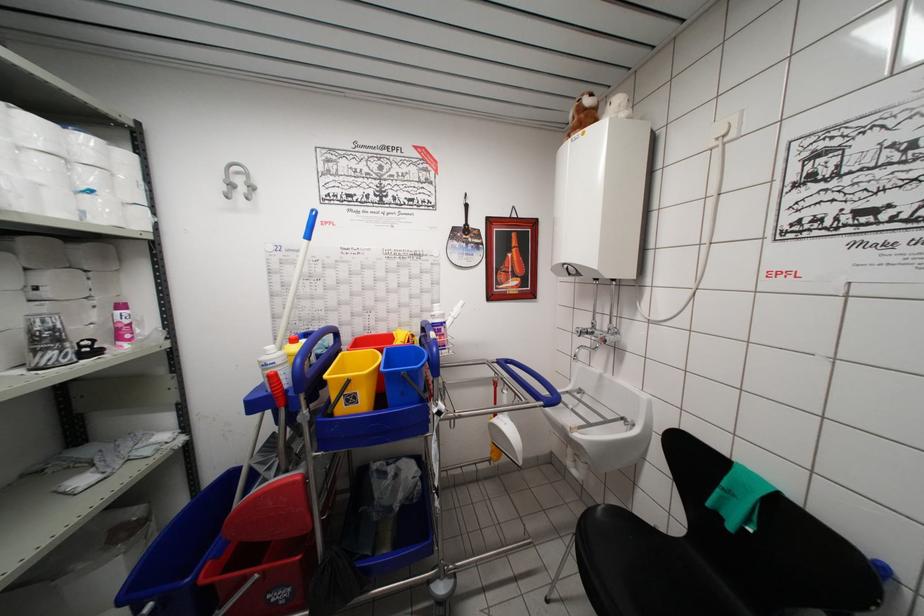
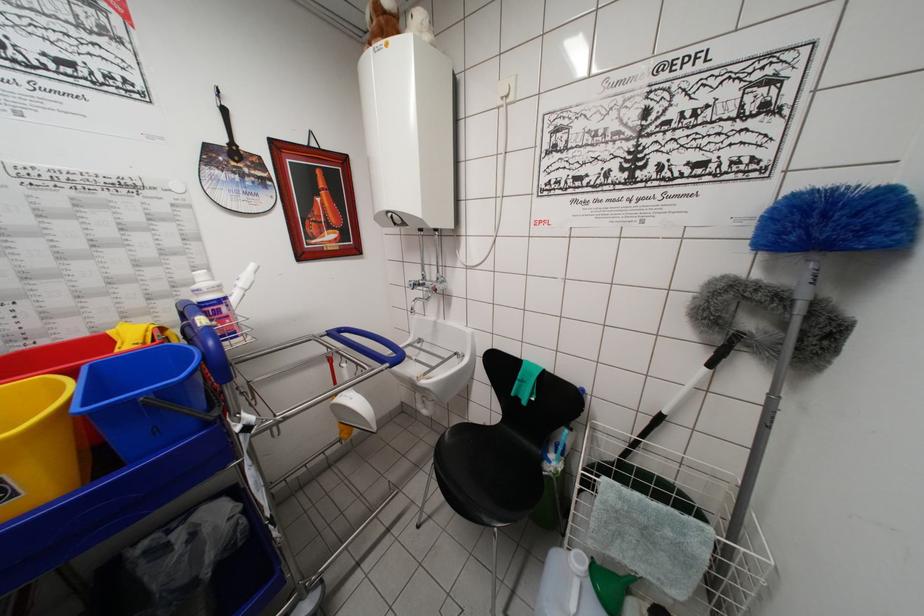
Find the pixel in the second image that matches point 596,342 in the first image.

(428, 294)